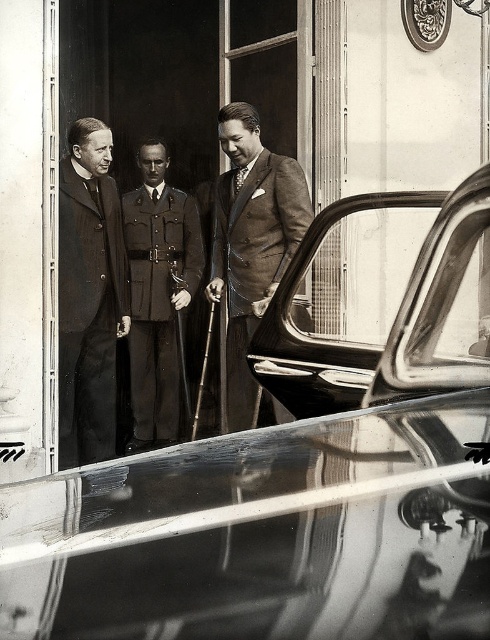
Question: Observing the image, what is the correct spatial positioning of shiny chrome door at center in reference to uniformed military at center?

Choices:
 (A) left
 (B) right

Answer: (B)

Question: From the image, what is the correct spatial relationship of smooth dark coat at left in relation to uniformed military at center?

Choices:
 (A) below
 (B) above

Answer: (A)

Question: Which object is farther from the camera taking this photo?

Choices:
 (A) uniformed military at center
 (B) brown wool suit at center
 (C) shiny chrome door at center
 (D) shiny chrome car at center

Answer: (A)

Question: Which point is closer to the camera taking this photo?

Choices:
 (A) (410, 200)
 (B) (119, 312)

Answer: (A)

Question: Is shiny chrome car at center positioned behind shiny chrome door at center?

Choices:
 (A) yes
 (B) no

Answer: (B)

Question: Which of the following is the farthest from the observer?

Choices:
 (A) (139, 616)
 (B) (235, 154)
 (C) (394, 324)

Answer: (B)